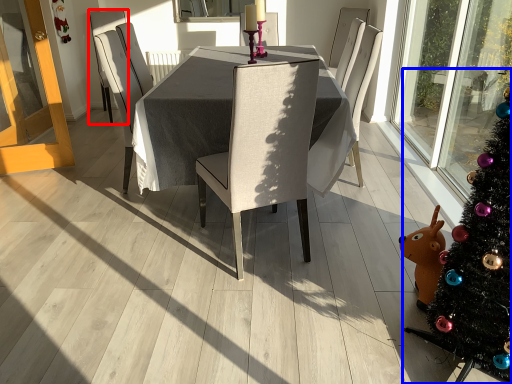
Question: Which object appears farthest to the camera in this image, chair (highlighted by a red box) or christmas tree (highlighted by a blue box)?

Choices:
 (A) chair
 (B) christmas tree

Answer: (A)